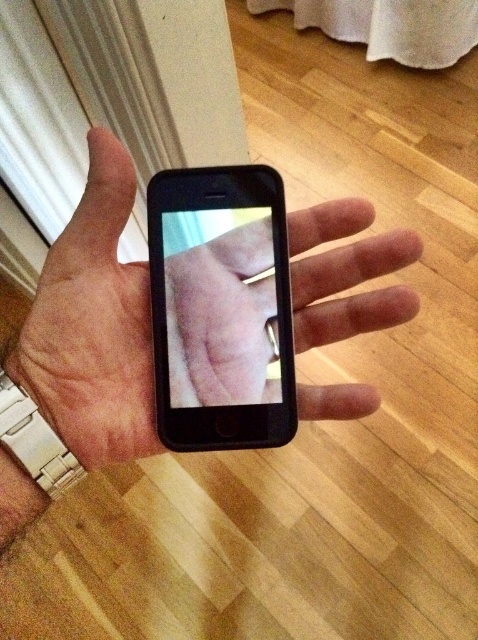
Question: Does black matte phone at center have a lesser width compared to black matte smartphone at center?

Choices:
 (A) yes
 (B) no

Answer: (B)

Question: Does black matte phone at center appear under black matte smartphone at center?

Choices:
 (A) no
 (B) yes

Answer: (A)

Question: Does black matte phone at center have a smaller size compared to black matte smartphone at center?

Choices:
 (A) yes
 (B) no

Answer: (B)

Question: Which of the following is the farthest from the observer?

Choices:
 (A) black matte smartphone at center
 (B) black matte phone at center

Answer: (A)

Question: Which point is farther to the camera?

Choices:
 (A) (116, 173)
 (B) (198, 260)

Answer: (B)